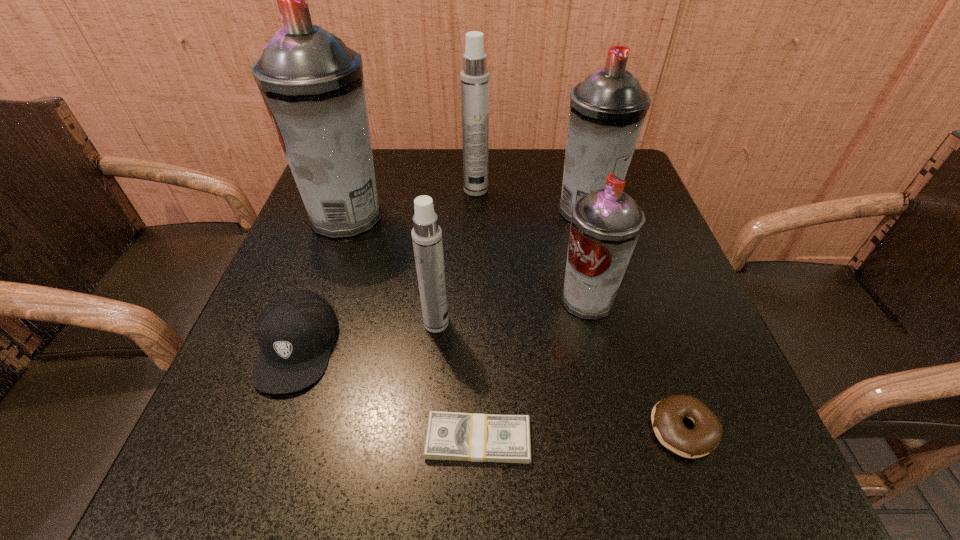
In order to click on doughnut in this screenshot , I will do `click(667, 415)`.

This screenshot has width=960, height=540. Find the location of `dollar`. dollar is located at coordinates (472, 437).

Find the location of a particular element. vacant region located 0.310m on the front of the biggest gray aerosol can is located at coordinates (296, 362).

This screenshot has height=540, width=960. I want to click on free space located 0.180m on the left of the second biggest gray aerosol can, so click(x=478, y=211).

In order to click on free spot located on the front of the farther white aerosol can in this screenshot , I will do `click(475, 264)`.

You are a GUI agent. You are given a task and a screenshot of the screen. Output one action in this format:
    pyautogui.click(x=<x>, y=<y>)
    Task: Click on the vacant region located on the left of the smallest gray aerosol can
    This screenshot has height=540, width=960.
    Given the screenshot: What is the action you would take?
    pyautogui.click(x=516, y=300)

This screenshot has width=960, height=540. I want to click on vacant position located 0.270m on the back of the left white aerosol can, so click(445, 224).

This screenshot has height=540, width=960. In order to click on blank area located 0.050m on the front-facing side of the cap in this screenshot , I will do `click(268, 427)`.

Find the location of a particular element. The image size is (960, 540). vacant space located on the back of the seventh tallest object is located at coordinates (663, 373).

At what (x,y) coordinates should I click in order to perform the action: click on vacant space located 0.050m on the front of the dollar. Please return your answer as a coordinate pair (x, y). Looking at the image, I should click on (478, 502).